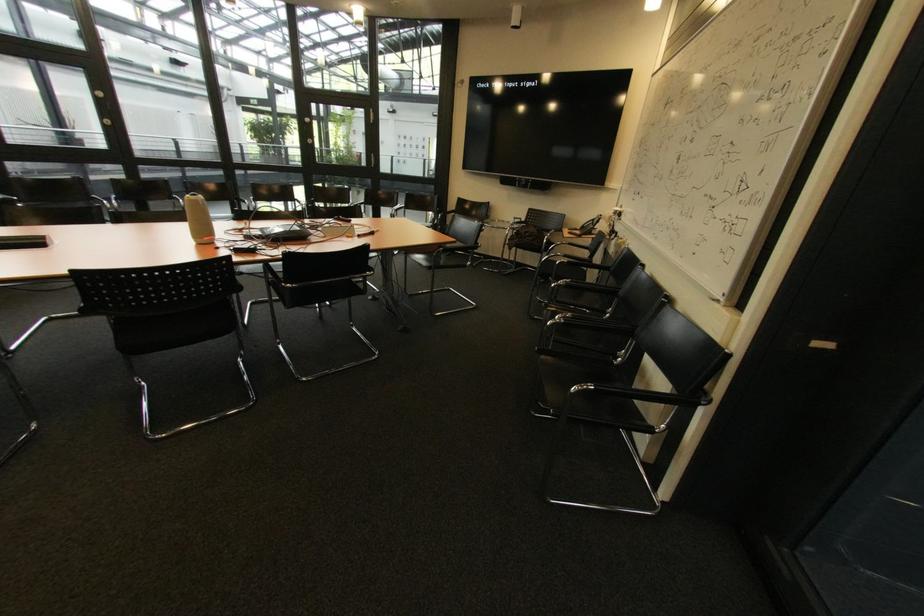
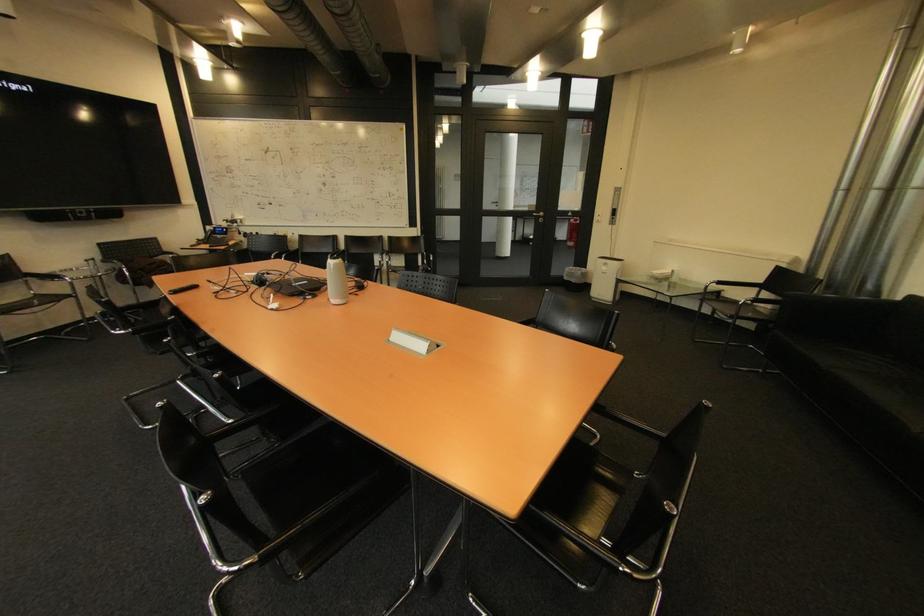
Question: I am providing you with two images of the same scene from different viewpoints. Please identify which objects are invisible in image2.

Choices:
 (A) chair armrest
 (B) red fire extinguisher
 (C) small wall handle
 (D) black remote control

Answer: (A)